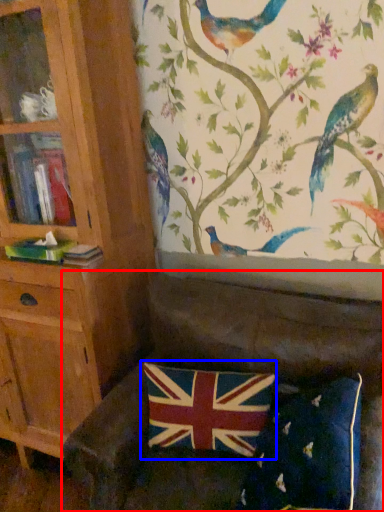
Question: Which point is further to the camera, studio couch (highlighted by a red box) or flag (highlighted by a blue box)?

Choices:
 (A) studio couch
 (B) flag

Answer: (B)